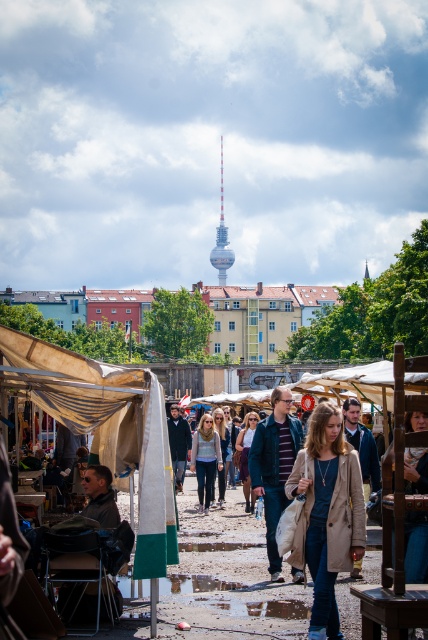
Which is more to the right, beige fabric canopy at lower left or matte gray sweater at center?

Positioned to the right is matte gray sweater at center.

Locate an element on the screen. This screenshot has height=640, width=428. beige fabric canopy at lower left is located at coordinates (107, 429).

Is point (145, 403) positioned after point (199, 499)?

No, (145, 403) is in front of (199, 499).

Image resolution: width=428 pixels, height=640 pixels. I want to click on beige fabric canopy at lower left, so point(107,429).

Is beige canvas tent at center shorter than silver metallic tower at center?

Yes, beige canvas tent at center is shorter than silver metallic tower at center.

Who is positioned more to the left, beige canvas tent at center or silver metallic tower at center?

beige canvas tent at center

Is point (124, 394) positioned in front of point (222, 268)?

Yes.

Find the location of `beige canvas tent at center`. beige canvas tent at center is located at coordinates (121, 442).

Between light beige coat at center and matte gray sweater at center, which one is positioned higher?

light beige coat at center is above.

Which is in front, point (308, 451) or point (192, 451)?

Point (308, 451) is in front.

Image resolution: width=428 pixels, height=640 pixels. I want to click on light beige coat at center, so click(326, 513).